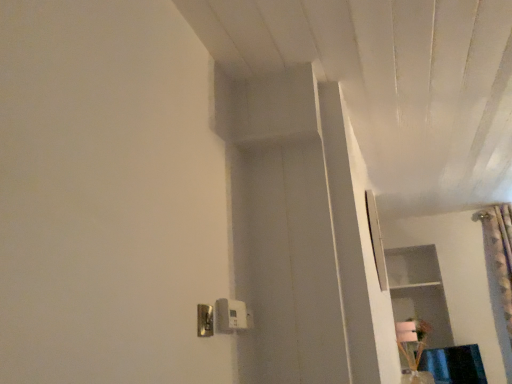
Question: From the image's perspective, relative to metallic silver light switch at lower center, marked as the first light switch in a front-to-back arrangement, is white plastic light switch at lower center, which is the first light switch in back-to-front order, above or below?

Choices:
 (A) below
 (B) above

Answer: (A)

Question: Based on their positions, is white plastic light switch at lower center, which is the first light switch in back-to-front order, located to the left or right of metallic silver light switch at lower center, marked as the first light switch in a front-to-back arrangement?

Choices:
 (A) right
 (B) left

Answer: (A)

Question: In the image, is white plastic light switch at lower center, which is the first light switch in back-to-front order, positioned in front of or behind metallic silver light switch at lower center, which is the 2th light switch in back-to-front order?

Choices:
 (A) behind
 (B) front

Answer: (A)

Question: In terms of width, does metallic silver light switch at lower center, which is the 2th light switch in back-to-front order, look wider or thinner when compared to white plastic light switch at lower center, which is the first light switch in back-to-front order?

Choices:
 (A) wide
 (B) thin

Answer: (B)

Question: From the image's perspective, is metallic silver light switch at lower center, which is the 2th light switch in back-to-front order, above or below white plastic light switch at lower center, which is the first light switch in back-to-front order?

Choices:
 (A) below
 (B) above

Answer: (B)

Question: From a real-world perspective, relative to white plastic light switch at lower center, the 2th light switch when ordered from front to back, is metallic silver light switch at lower center, marked as the first light switch in a front-to-back arrangement, vertically above or below?

Choices:
 (A) below
 (B) above

Answer: (A)

Question: Considering the positions of metallic silver light switch at lower center, marked as the first light switch in a front-to-back arrangement, and white plastic light switch at lower center, which is the first light switch in back-to-front order, in the image, is metallic silver light switch at lower center, marked as the first light switch in a front-to-back arrangement, taller or shorter than white plastic light switch at lower center, which is the first light switch in back-to-front order,?

Choices:
 (A) tall
 (B) short

Answer: (B)